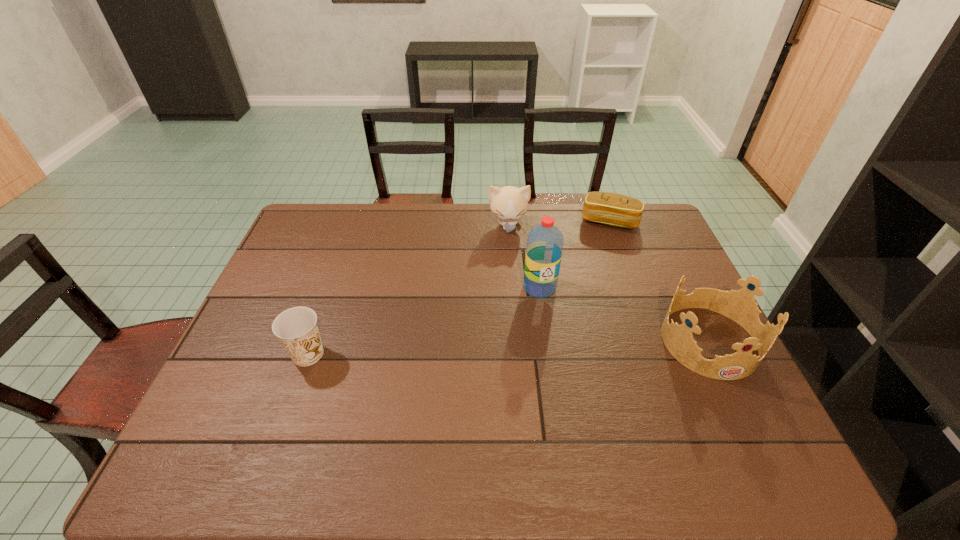
This screenshot has width=960, height=540. I want to click on Dixie cup, so click(297, 329).

Locate an element on the screen. the fourth tallest object is located at coordinates (297, 329).

Image resolution: width=960 pixels, height=540 pixels. Identify the location of tiara. (740, 306).

You are a GUI agent. You are given a task and a screenshot of the screen. Output one action in this format:
    pyautogui.click(x=<x>, y=<y>)
    Task: Click on the clutch bag
    Image resolution: width=960 pixels, height=540 pixels.
    Given the screenshot: What is the action you would take?
    pyautogui.click(x=613, y=209)

What are the coordinates of `the tallest object` in the screenshot? It's located at (544, 248).

This screenshot has height=540, width=960. In order to click on water bottle in this screenshot , I will do `click(544, 248)`.

I want to click on kitten, so click(x=509, y=203).

At what (x,y) coordinates should I click in order to perform the action: click on vacant space situated on the back of the Dixie cup. Please return your answer as a coordinate pair (x, y). The height and width of the screenshot is (540, 960). Looking at the image, I should click on (342, 258).

At what (x,y) coordinates should I click in order to perform the action: click on free space located on the front-facing side of the tiara. Please return your answer as a coordinate pair (x, y). This screenshot has width=960, height=540. Looking at the image, I should click on (736, 398).

Find the location of a particular element. The height and width of the screenshot is (540, 960). free space located 0.370m on the zipper side of the shortest object is located at coordinates (577, 304).